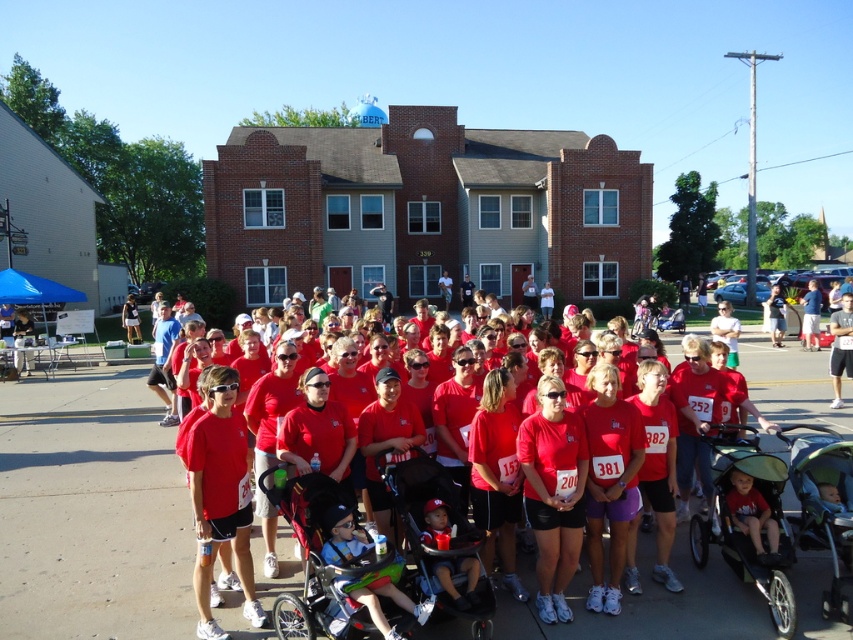
Find the location of `matte black stroller at center`. matte black stroller at center is located at coordinates (376, 557).

In the scene shown: Is matte black stroller at center positioned at the back of matte red shirt at center?

That is False.

Is point (310, 580) in front of point (659, 593)?

Yes, it is in front of point (659, 593).

The height and width of the screenshot is (640, 853). In order to click on matte black stroller at center in this screenshot , I will do `click(376, 557)`.